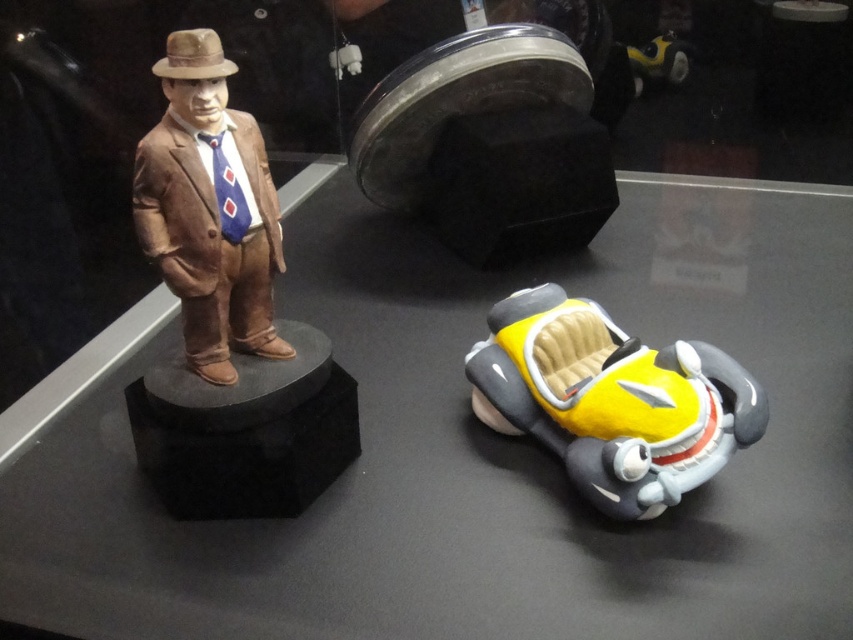
Can you confirm if yellow matte car at lower right is taller than matte brown statue at left?

No.

The height and width of the screenshot is (640, 853). What do you see at coordinates (611, 401) in the screenshot?
I see `yellow matte car at lower right` at bounding box center [611, 401].

Does point (589, 404) come behind point (154, 228)?

Yes, it is behind point (154, 228).

Identify the location of yellow matte car at lower right. (611, 401).